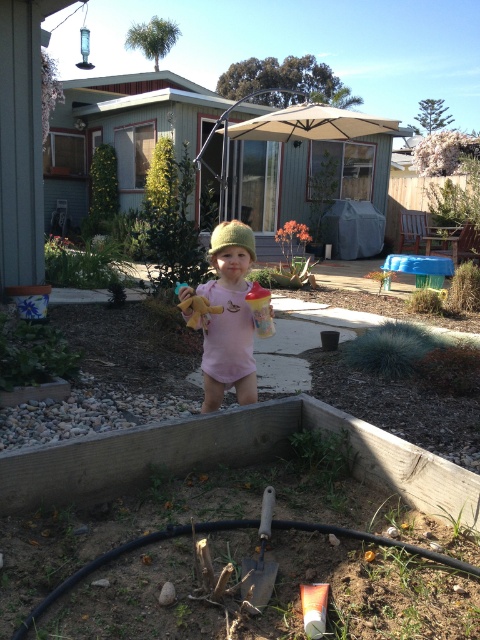
Question: Among these objects, which one is nearest to the camera?

Choices:
 (A) blue fabric flower bed at lower left
 (B) wooden shovel at center
 (C) black rubber garden hose at lower center
 (D) pink knit hat at center

Answer: (C)

Question: Is pink knit hat at center above wooden shovel at center?

Choices:
 (A) no
 (B) yes

Answer: (B)

Question: Which of the following is the closest to the observer?

Choices:
 (A) (255, 563)
 (B) (204, 324)
 (C) (38, 289)

Answer: (A)

Question: Which point appears farthest from the camera in this image?

Choices:
 (A) (104, 560)
 (B) (245, 588)

Answer: (A)

Question: Considering the relative positions of blue fabric flower bed at lower left and yellow plush bear at center in the image provided, where is blue fabric flower bed at lower left located with respect to yellow plush bear at center?

Choices:
 (A) left
 (B) right

Answer: (A)

Question: Can you confirm if pink knit hat at center is positioned to the left of blue fabric flower bed at lower left?

Choices:
 (A) no
 (B) yes

Answer: (A)